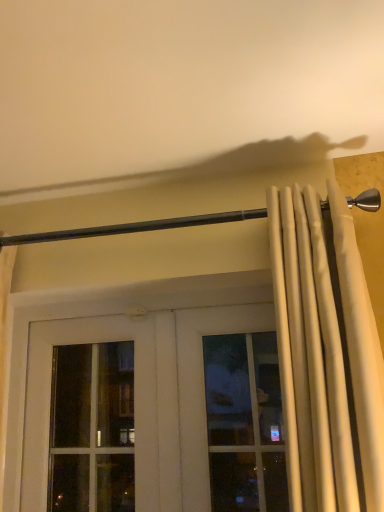
Question: From a real-world perspective, is white fabric curtain at right below black metal rod at upper center?

Choices:
 (A) yes
 (B) no

Answer: (A)

Question: Is black metal rod at upper center completely or partially inside white fabric curtain at right?

Choices:
 (A) no
 (B) yes

Answer: (A)

Question: Is white fabric curtain at right to the right of black metal rod at upper center from the viewer's perspective?

Choices:
 (A) yes
 (B) no

Answer: (A)

Question: Is white fabric curtain at right at the left side of black metal rod at upper center?

Choices:
 (A) no
 (B) yes

Answer: (A)

Question: Is white fabric curtain at right oriented towards black metal rod at upper center?

Choices:
 (A) yes
 (B) no

Answer: (B)

Question: Is white fabric curtain at right positioned beyond the bounds of black metal rod at upper center?

Choices:
 (A) no
 (B) yes

Answer: (B)

Question: From the image's perspective, is black metal rod at upper center on white fabric curtain at right?

Choices:
 (A) no
 (B) yes

Answer: (B)

Question: Can you confirm if black metal rod at upper center is thinner than white fabric curtain at right?

Choices:
 (A) no
 (B) yes

Answer: (B)

Question: Is black metal rod at upper center positioned far away from white fabric curtain at right?

Choices:
 (A) no
 (B) yes

Answer: (A)

Question: Is black metal rod at upper center at the right side of white fabric curtain at right?

Choices:
 (A) yes
 (B) no

Answer: (B)

Question: From a real-world perspective, is black metal rod at upper center physically above white fabric curtain at right?

Choices:
 (A) no
 (B) yes

Answer: (B)

Question: Is black metal rod at upper center oriented away from white fabric curtain at right?

Choices:
 (A) no
 (B) yes

Answer: (A)

Question: In terms of width, does black metal rod at upper center look wider or thinner when compared to white fabric curtain at right?

Choices:
 (A) thin
 (B) wide

Answer: (A)